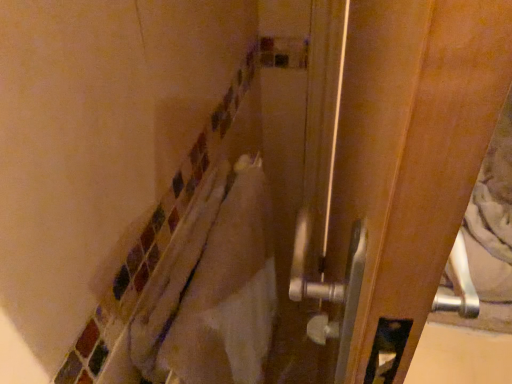
What do you see at coordinates (410, 156) in the screenshot? Image resolution: width=512 pixels, height=384 pixels. I see `wooden screen door at right` at bounding box center [410, 156].

This screenshot has height=384, width=512. I want to click on wooden screen door at right, so click(x=410, y=156).

I want to click on white towel at center, so click(x=228, y=290).

Describe the element at coordinates (228, 290) in the screenshot. I see `white towel at center` at that location.

Where is `wooden screen door at right`? wooden screen door at right is located at coordinates (410, 156).

Which object is positioned more to the left, wooden screen door at right or white towel at center?

From the viewer's perspective, white towel at center appears more on the left side.

Is wooden screen door at right further to the viewer compared to white towel at center?

No, the depth of wooden screen door at right is less than that of white towel at center.

Between point (455, 116) and point (259, 249), which one is positioned behind?

Positioned behind is point (259, 249).

From the image's perspective, is wooden screen door at right located above white towel at center?

Indeed, from the image's perspective, wooden screen door at right is shown above white towel at center.

From a real-world perspective, is wooden screen door at right on white towel at center?

Yes.

Does wooden screen door at right have a greater width compared to white towel at center?

Incorrect, the width of wooden screen door at right does not surpass that of white towel at center.

Considering the relative sizes of wooden screen door at right and white towel at center in the image provided, is wooden screen door at right shorter than white towel at center?

No.

Considering the sizes of wooden screen door at right and white towel at center in the image, is wooden screen door at right bigger or smaller than white towel at center?

wooden screen door at right is bigger than white towel at center.

Is wooden screen door at right surrounding white towel at center?

Definitely not — white towel at center is not inside wooden screen door at right.

Is wooden screen door at right placed right next to white towel at center?

No, wooden screen door at right is not next to white towel at center.

Is wooden screen door at right oriented away from white towel at center?

Yes.

Where is `screen door on the right of white towel at center`? Image resolution: width=512 pixels, height=384 pixels. screen door on the right of white towel at center is located at coordinates (410, 156).

In the image, is white towel at center on the left side or the right side of wooden screen door at right?

From the image, it's evident that white towel at center is to the left of wooden screen door at right.

Which is in front, white towel at center or wooden screen door at right?

wooden screen door at right is closer to the camera.

Between point (170, 368) and point (345, 49), which one is positioned in front?

Point (170, 368)

From the image's perspective, is white towel at center located above wooden screen door at right?

Actually, white towel at center appears below wooden screen door at right in the image.

From a real-world perspective, is white towel at center physically located above or below wooden screen door at right?

In terms of real-world spatial position, white towel at center is below wooden screen door at right.

From the picture: Does white towel at center have a greater width compared to wooden screen door at right?

Correct, the width of white towel at center exceeds that of wooden screen door at right.

Is white towel at center taller or shorter than wooden screen door at right?

white towel at center is shorter than wooden screen door at right.

Between white towel at center and wooden screen door at right, which one has smaller size?

white towel at center.

Is white towel at center located outside wooden screen door at right?

Yes, white towel at center is not within wooden screen door at right.

Does white towel at center touch wooden screen door at right?

No, white towel at center is not in contact with wooden screen door at right.

Is white towel at center turned away from wooden screen door at right?

Yes, wooden screen door at right is at the back of white towel at center.

How far apart are white towel at center and wooden screen door at right?

white towel at center and wooden screen door at right are 19.71 centimeters apart.

This screenshot has height=384, width=512. There is a white towel at center. Find the location of `screen door above it (from a real-world perspective)`. screen door above it (from a real-world perspective) is located at coordinates (410, 156).

There is a white towel at center. At what (x,y) coordinates should I click in order to perform the action: click on screen door above it (from a real-world perspective). Please return your answer as a coordinate pair (x, y). The width and height of the screenshot is (512, 384). Looking at the image, I should click on (410, 156).

Locate an element on the screen. material on the left side of wooden screen door at right is located at coordinates (228, 290).